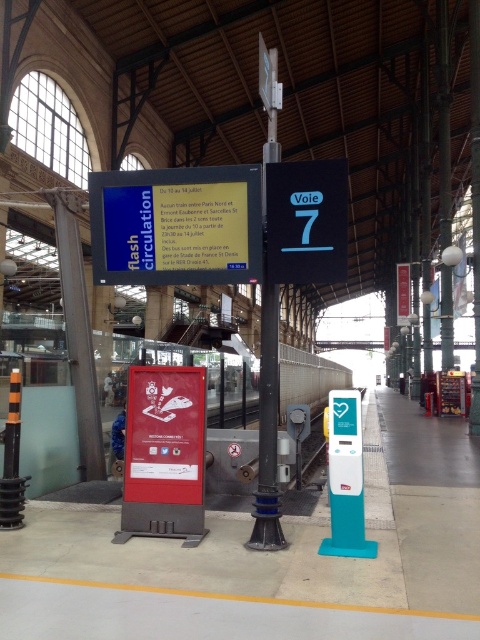
You are a traveler at the train station and need to read the information on the black plastic sign at center and the metallic pole at center. Which one is closer to you?

The black plastic sign at center is in front of the metallic pole at center, so it is closer to you.

You are a passenger standing on the train station platform and want to read both the black plastic sign at center and the metallic glass pillar at left. Which object will you need to walk towards first to get a closer look?

The black plastic sign at center is closer to the viewer than the metallic glass pillar at left, so you should walk towards the metallic glass pillar at left first to get closer.